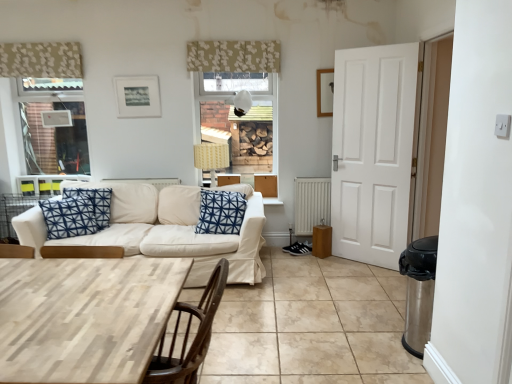
The image size is (512, 384). What do you see at coordinates (162, 230) in the screenshot? I see `white fabric couch at center` at bounding box center [162, 230].

Image resolution: width=512 pixels, height=384 pixels. Describe the element at coordinates (221, 212) in the screenshot. I see `blue printed cushion at center` at that location.

You are a GUI agent. You are given a task and a screenshot of the screen. Output one action in this format:
    pyautogui.click(x=<x>, y=<y>)
    Task: Click on the light wood table at lower left
    Image resolution: width=512 pixels, height=384 pixels.
    Given the screenshot: What is the action you would take?
    pyautogui.click(x=84, y=317)

Image resolution: width=512 pixels, height=384 pixels. Describe the element at coordinates (137, 96) in the screenshot. I see `matte black picture frame at upper center, positioned as the 2th picture frame in right-to-left order` at that location.

You are a GUI agent. You are given a task and a screenshot of the screen. Output one action in this format:
    pyautogui.click(x=<x>, y=<y>)
    Task: Click on the beige tile at lower center
    The width and height of the screenshot is (512, 384).
    Given the screenshot: What is the action you would take?
    pyautogui.click(x=313, y=326)

The width and height of the screenshot is (512, 384). Identify the location of white fabric couch at center. (162, 230).

Considering the sizes of objects white fabric couch at center and wooden picture frame at upper right, positioned as the 1th picture frame in right-to-left order, in the image provided, who is bigger, white fabric couch at center or wooden picture frame at upper right, positioned as the 1th picture frame in right-to-left order,?

Bigger between the two is white fabric couch at center.

From a real-world perspective, is white fabric couch at center positioned above or below wooden picture frame at upper right, marked as the second picture frame in a left-to-right arrangement?

In terms of real-world spatial position, white fabric couch at center is below wooden picture frame at upper right, marked as the second picture frame in a left-to-right arrangement.

In the scene shown: Who is more distant, white fabric couch at center or wooden picture frame at upper right, marked as the second picture frame in a left-to-right arrangement?

wooden picture frame at upper right, marked as the second picture frame in a left-to-right arrangement, is further away from the camera.

Is white fabric couch at center at the right side of wooden picture frame at upper right, marked as the second picture frame in a left-to-right arrangement?

In fact, white fabric couch at center is to the left of wooden picture frame at upper right, marked as the second picture frame in a left-to-right arrangement.

From a real-world perspective, is white glossy door at right above or below white metallic radiator at lower center?

white glossy door at right is above white metallic radiator at lower center.

The image size is (512, 384). I want to click on radiator that is below the white glossy door at right (from the image's perspective), so click(311, 204).

From the image's perspective, between white glossy door at right and white metallic radiator at lower center, which one is located above?

From the image's view, white glossy door at right is above.

Is white glossy door at right inside the boundaries of light wood table at lower left, or outside?

white glossy door at right is outside light wood table at lower left.

Considering the sizes of objects white glossy door at right and light wood table at lower left in the image provided, who is smaller, white glossy door at right or light wood table at lower left?

With smaller size is white glossy door at right.

Which is in front, white glossy door at right or light wood table at lower left?

light wood table at lower left is in front.

Is white glossy door at right turned away from light wood table at lower left?

No.

Is point (211, 206) closer to camera compared to point (137, 299)?

No, it is not.

Is blue printed cushion at center aimed at light wood table at lower left?

Yes, blue printed cushion at center is turned towards light wood table at lower left.

In terms of width, does blue printed cushion at center look wider or thinner when compared to light wood table at lower left?

In the image, blue printed cushion at center appears to be more narrow than light wood table at lower left.

Which of these two, blue printed cushion at center or light wood table at lower left, is bigger?

Bigger between the two is light wood table at lower left.

Can we say blue printed cushion at center lies outside matte black picture frame at upper center, positioned as the 2th picture frame in right-to-left order?

Indeed, blue printed cushion at center is completely outside matte black picture frame at upper center, positioned as the 2th picture frame in right-to-left order.

From a real-world perspective, is blue printed cushion at center on top of matte black picture frame at upper center, which ranks as the 1th picture frame in left-to-right order?

No, from a real-world perspective, blue printed cushion at center is not over matte black picture frame at upper center, which ranks as the 1th picture frame in left-to-right order

Which is closer, (230, 200) or (155, 107)?

Clearly, point (230, 200) is closer to the camera than point (155, 107).

Locate an element on the screen. This screenshot has height=384, width=512. side on the right of blue printed cushion at center is located at coordinates (476, 206).

Is blue printed cushion at center next to white glossy door at right?

blue printed cushion at center and white glossy door at right are clearly separated.

Which object is further away from the camera, blue printed cushion at center or white glossy door at right?

blue printed cushion at center.

From the image's perspective, is blue printed cushion at center above or below white glossy door at right?

From the image's perspective, blue printed cushion at center appears below white glossy door at right.

Considering the sizes of wooden picture frame at upper right, positioned as the 1th picture frame in right-to-left order, and beige tile at lower center in the image, is wooden picture frame at upper right, positioned as the 1th picture frame in right-to-left order, wider or thinner than beige tile at lower center?

Clearly, wooden picture frame at upper right, positioned as the 1th picture frame in right-to-left order, has less width compared to beige tile at lower center.

The height and width of the screenshot is (384, 512). Identify the location of the 2nd picture frame above the beige tile at lower center (from the image's perspective). (325, 92).

Considering the relative sizes of wooden picture frame at upper right, positioned as the 1th picture frame in right-to-left order, and beige tile at lower center in the image provided, is wooden picture frame at upper right, positioned as the 1th picture frame in right-to-left order, smaller than beige tile at lower center?

Correct, wooden picture frame at upper right, positioned as the 1th picture frame in right-to-left order, occupies less space than beige tile at lower center.

From the image's perspective, count 2nd picture frames upward from the white fabric couch at center and point to it. Please provide its 2D coordinates.

[(325, 92)]

Identify the location of radiator that appears behind the white glossy door at right. (311, 204).

When comparing their distances from wooden picture frame at upper right, marked as the second picture frame in a left-to-right arrangement, does matte black picture frame at upper center, positioned as the 2th picture frame in right-to-left order, or light wood table at lower left seem closer?

matte black picture frame at upper center, positioned as the 2th picture frame in right-to-left order, is closer to wooden picture frame at upper right, marked as the second picture frame in a left-to-right arrangement.

From the image, which object appears to be nearer to floral fabric curtain at upper center, which is the first curtain in right-to-left order, beige tile at lower center or light wood table at lower left?

beige tile at lower center is positioned closer to the anchor floral fabric curtain at upper center, which is the first curtain in right-to-left order.

Looking at the image, which one is located closer to matte black picture frame at upper center, which ranks as the 1th picture frame in left-to-right order, light wood table at lower left or beige tile at lower center?

beige tile at lower center is positioned closer to the anchor matte black picture frame at upper center, which ranks as the 1th picture frame in left-to-right order.

Looking at the image, which one is located further to white glossy door at right, beige tile at lower center or wooden picture frame at upper right, marked as the second picture frame in a left-to-right arrangement?

wooden picture frame at upper right, marked as the second picture frame in a left-to-right arrangement.

From the image, which object appears to be nearer to white glossy door at right, white metallic radiator at lower center or white fabric couch at center?

The object closer to white glossy door at right is white fabric couch at center.

Considering their positions, is white glossy door at right positioned closer to wooden picture frame at upper right, positioned as the 1th picture frame in right-to-left order, than blue printed cushion at center?

blue printed cushion at center is closer to wooden picture frame at upper right, positioned as the 1th picture frame in right-to-left order.

Which object lies further to the anchor point white glossy door at right, light wood table at lower left or white metallic radiator at lower center?

white metallic radiator at lower center is further to white glossy door at right.

Considering their positions, is matte black picture frame at upper center, which ranks as the 1th picture frame in left-to-right order, positioned closer to light wood table at lower left than wooden picture frame at upper right, marked as the second picture frame in a left-to-right arrangement?

matte black picture frame at upper center, which ranks as the 1th picture frame in left-to-right order, lies closer to light wood table at lower left than the other object.

Locate an element on the screen. picture frame between patterned fabric curtain at upper left, which is the 2th curtain in right-to-left order, and blue printed cushion at center is located at coordinates (137, 96).

Where is `tile located between light wood table at lower left and blue printed cushion at center in the depth direction`? Image resolution: width=512 pixels, height=384 pixels. tile located between light wood table at lower left and blue printed cushion at center in the depth direction is located at coordinates [x=313, y=326].

Identify the location of tile between light wood table at lower left and white glossy door at right in the horizontal direction. This screenshot has height=384, width=512. (313, 326).

The image size is (512, 384). Find the location of `radiator located between patterned fabric curtain at upper left, which is the 2th curtain in right-to-left order, and wooden picture frame at upper right, positioned as the 1th picture frame in right-to-left order, in the left-right direction`. radiator located between patterned fabric curtain at upper left, which is the 2th curtain in right-to-left order, and wooden picture frame at upper right, positioned as the 1th picture frame in right-to-left order, in the left-right direction is located at coordinates [311, 204].